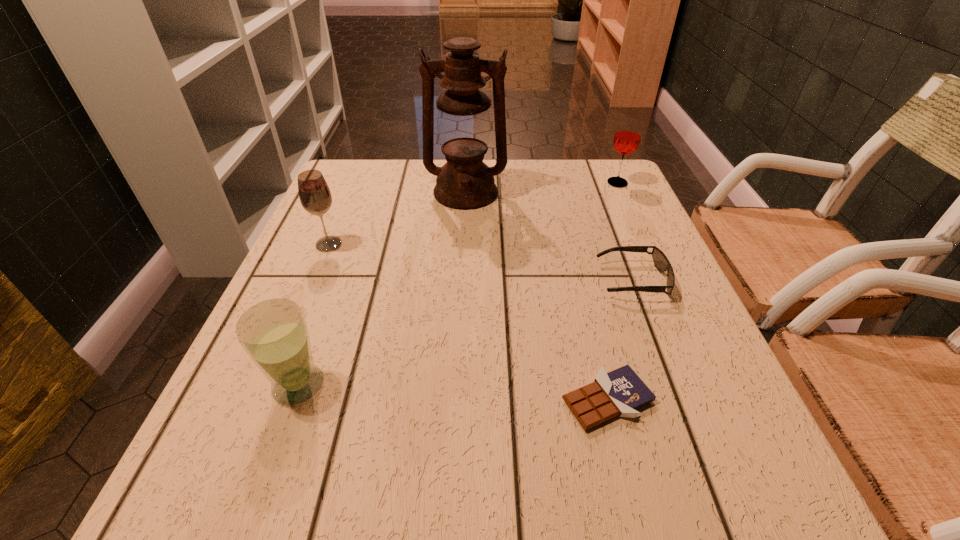
Identify the location of vacant space in between the oil lamp and the second nearest glass. (397, 219).

Where is `unoccupied position between the chocolate bar and the tallest object`? The height and width of the screenshot is (540, 960). unoccupied position between the chocolate bar and the tallest object is located at coordinates (537, 296).

In order to click on vacant area that lies between the second shortest object and the chocolate bar in this screenshot , I will do `click(619, 340)`.

Locate an element on the screen. free area in between the sunglasses and the shortest object is located at coordinates click(x=619, y=340).

Identify the location of vacant space that's between the sunglasses and the second farthest glass. (480, 262).

This screenshot has height=540, width=960. What are the coordinates of `vacant space that's between the tallest object and the nearest glass` in the screenshot? It's located at (382, 289).

Find the location of a particular element. free space between the chocolate bar and the oil lamp is located at coordinates (537, 296).

Locate an element on the screen. free space between the tallest object and the rightmost glass is located at coordinates (541, 187).

In order to click on object that can be found as the fifth closest to the nearest glass in this screenshot , I will do `click(627, 137)`.

Find the location of a particular element. object that ranks as the closest to the nearest glass is located at coordinates (314, 194).